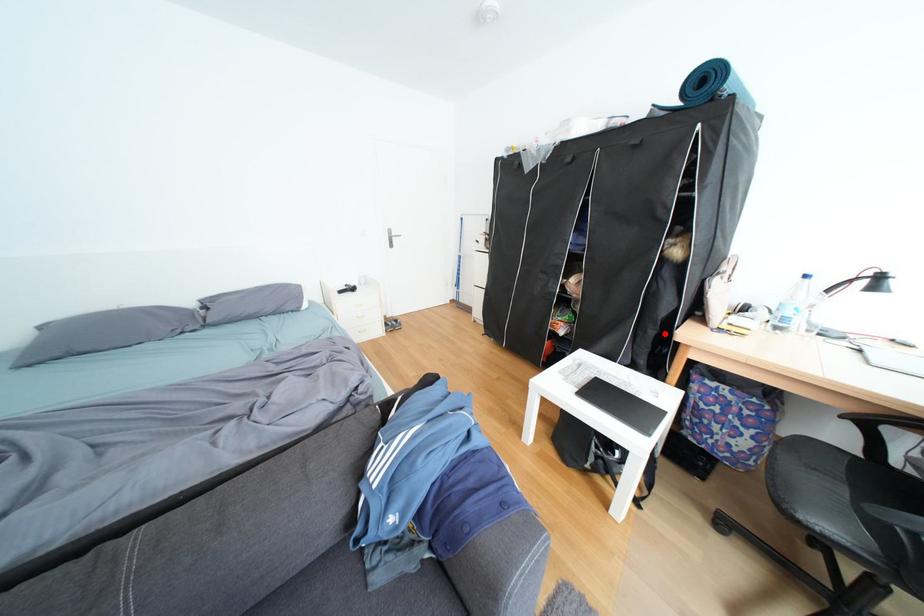
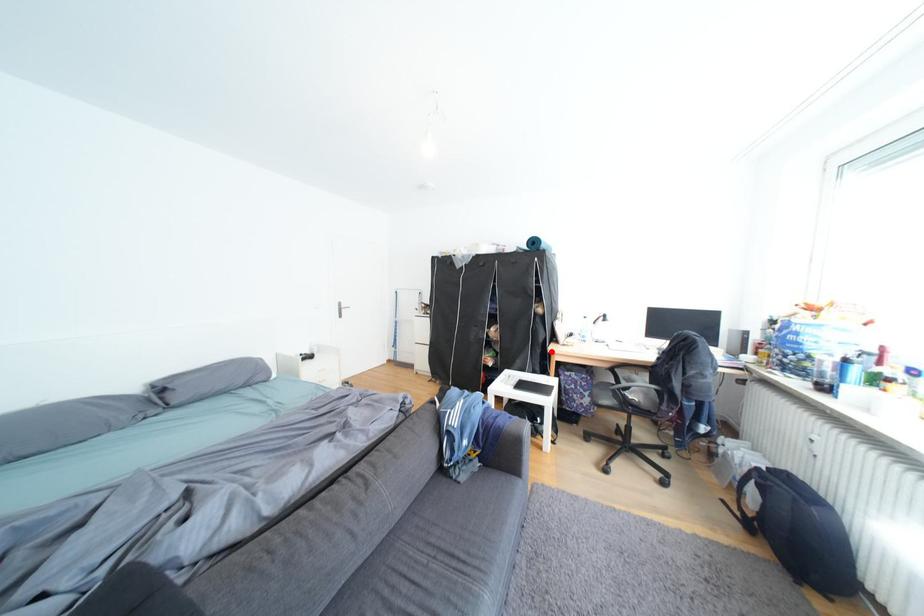
I am providing you with two images of the same scene from different viewpoints. A red point is marked on the first image and another point is marked on the second image. Are the points marked in image1 and image2 representing the same 3D position?

Yes